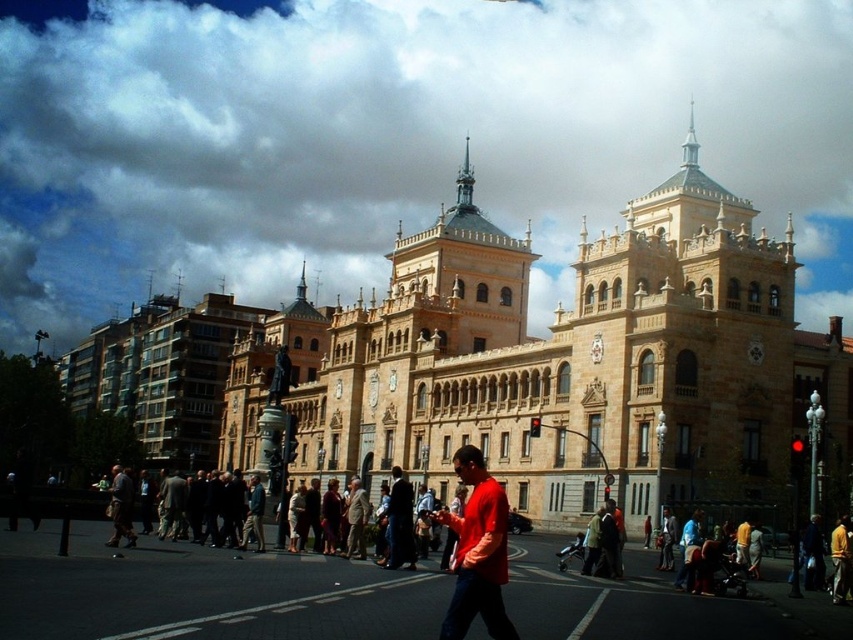
You are standing in front of the grand building and see two people wearing a matte red shirt at center and a light brown leather jacket at center. Which clothing item is positioned more to the right?

The matte red shirt at center is positioned to the right of the light brown leather jacket at center, so the matte red shirt at center is more to the right.

You are standing in the middle of the scene and want to take a photo of the golden stone palace at center without including the dark blue jeans at center in the frame. Which direction should you move to achieve this?

You should move to the left to position yourself so the golden stone palace at center is no longer blocked by the dark blue jeans at center, as the palace is to the right of the jeans.

You are an architect designing a new plaza in front of the golden stone palace at center and dark blue jeans at center. The city requires that the plaza must accommodate both structures while ensuring the palace remains the focal point. Given their sizes, how should you arrange them to meet the requirements?

Since the golden stone palace at center is wider than the dark blue jeans at center, you should place the golden stone palace at center centrally and position the dark blue jeans at center off to one side to maintain the palace as the main focus while incorporating both structures into the plaza design.